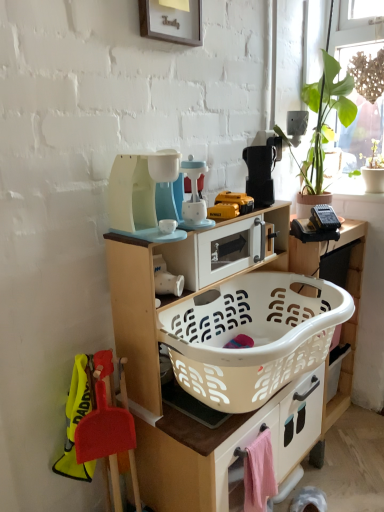
Question: Is matte plastic toy coffee maker at center, which is counted as the 4th appliance, starting from the right, turned away from woven wood screen at upper right?

Choices:
 (A) yes
 (B) no

Answer: (B)

Question: Is matte plastic toy coffee maker at center, which is the 1th appliance from left to right, at the left side of woven wood screen at upper right?

Choices:
 (A) no
 (B) yes

Answer: (B)

Question: Does matte plastic toy coffee maker at center, which is counted as the 4th appliance, starting from the right, appear on the right side of woven wood screen at upper right?

Choices:
 (A) no
 (B) yes

Answer: (A)

Question: Is matte plastic toy coffee maker at center, which is the 1th appliance from left to right, not within woven wood screen at upper right?

Choices:
 (A) yes
 (B) no

Answer: (A)

Question: Is the position of matte plastic toy coffee maker at center, which is counted as the 4th appliance, starting from the right, more distant than that of woven wood screen at upper right?

Choices:
 (A) yes
 (B) no

Answer: (B)

Question: In terms of size, does white matte cup at center, positioned as the 2th appliance in left-to-right order, appear bigger or smaller than pink fabric drawer at lower right?

Choices:
 (A) small
 (B) big

Answer: (A)

Question: In the image, is white matte cup at center, positioned as the 2th appliance in left-to-right order, on the left side or the right side of pink fabric drawer at lower right?

Choices:
 (A) right
 (B) left

Answer: (B)

Question: From the image's perspective, is white matte cup at center, positioned as the 3th appliance in right-to-left order, above or below pink fabric drawer at lower right?

Choices:
 (A) above
 (B) below

Answer: (A)

Question: From a real-world perspective, relative to pink fabric drawer at lower right, is white matte cup at center, positioned as the 3th appliance in right-to-left order, vertically above or below?

Choices:
 (A) above
 (B) below

Answer: (A)

Question: Is white matte cup at center, positioned as the 3th appliance in right-to-left order, inside or outside of black plastic toaster at upper center, placed as the 4th appliance when sorted from left to right?

Choices:
 (A) outside
 (B) inside

Answer: (A)

Question: From a real-world perspective, is white matte cup at center, positioned as the 2th appliance in left-to-right order, physically located above or below black plastic toaster at upper center, the first appliance from the right?

Choices:
 (A) below
 (B) above

Answer: (A)

Question: In the image, is white matte cup at center, positioned as the 3th appliance in right-to-left order, positioned in front of or behind black plastic toaster at upper center, placed as the 4th appliance when sorted from left to right?

Choices:
 (A) front
 (B) behind

Answer: (A)

Question: From the image's perspective, is white matte cup at center, positioned as the 3th appliance in right-to-left order, located above or below black plastic toaster at upper center, the first appliance from the right?

Choices:
 (A) above
 (B) below

Answer: (B)

Question: Considering the positions of matte plastic toy coffee maker at center, which is counted as the 4th appliance, starting from the right, and black plastic toaster at upper center, the first appliance from the right, in the image, is matte plastic toy coffee maker at center, which is counted as the 4th appliance, starting from the right, taller or shorter than black plastic toaster at upper center, the first appliance from the right,?

Choices:
 (A) short
 (B) tall

Answer: (B)

Question: From the image's perspective, is matte plastic toy coffee maker at center, which is the 1th appliance from left to right, positioned above or below black plastic toaster at upper center, the first appliance from the right?

Choices:
 (A) below
 (B) above

Answer: (A)